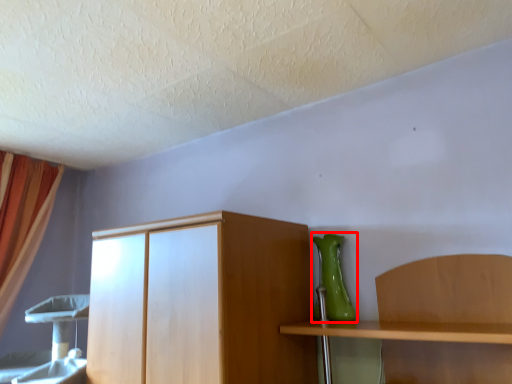
Question: From the image's perspective, what is the correct spatial relationship of vase (annotated by the red box) in relation to curtain?

Choices:
 (A) below
 (B) above

Answer: (B)